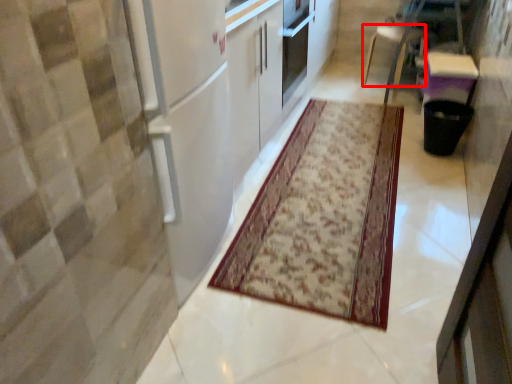
Question: Where is furniture (annotated by the red box) located in relation to mat in the image?

Choices:
 (A) right
 (B) left

Answer: (A)